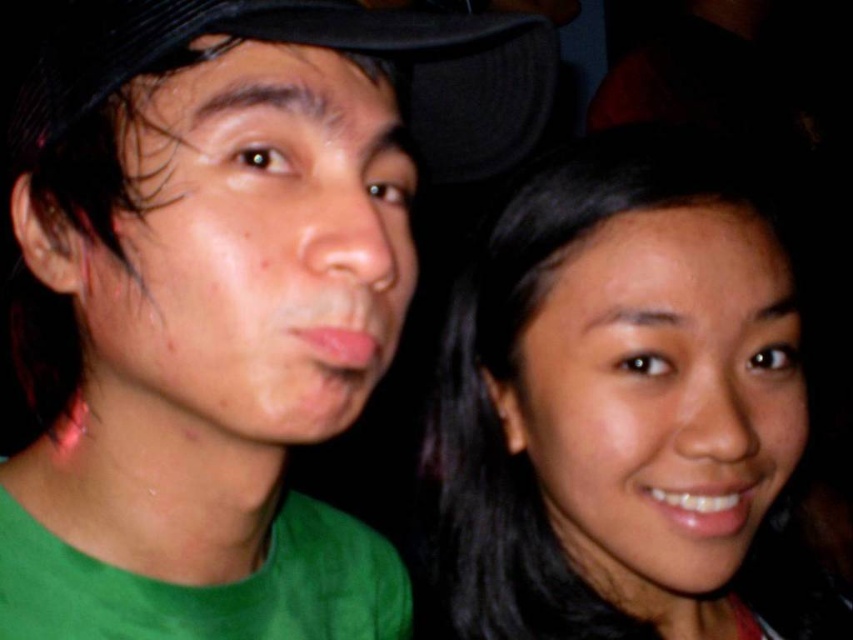
You are a photographer trying to frame a closeup shot of the black fabric cap at upper center. You need to ensure that the green matte shirt at left does not block the view. Given their sizes, can you fit the cap into the frame without the shirt overlapping?

The green matte shirt at left is wider than the black fabric cap at upper center. Since the shirt is wider, it might still block the cap even if the cap is at upper center. Adjust the angle or zoom to focus solely on the cap to avoid overlap.

You are a photographer trying to adjust the lighting for a portrait. You notice the green matte shirt at left and the smooth skin face at right. Which object should you focus on first to ensure proper exposure, considering their positions?

The green matte shirt at left is in front of the smooth skin face at right, so you should focus on the green matte shirt at left first to ensure proper exposure.

You are a photographer who needs to adjust the lighting between the green matte shirt at left and the smooth skin face at right to ensure proper exposure. Since the two subjects are 14.88 centimeters apart, how might you position your camera to capture both effectively?

The green matte shirt at left and smooth skin face at right are 14.88 centimeters apart. To capture both effectively, position the camera so that the lighting evenly illuminates both subjects, considering their close proximity.